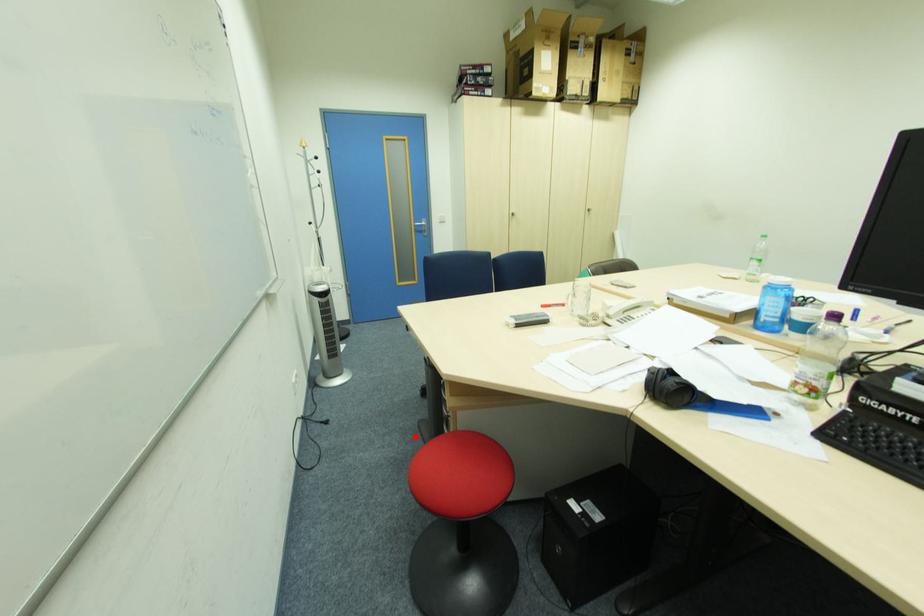
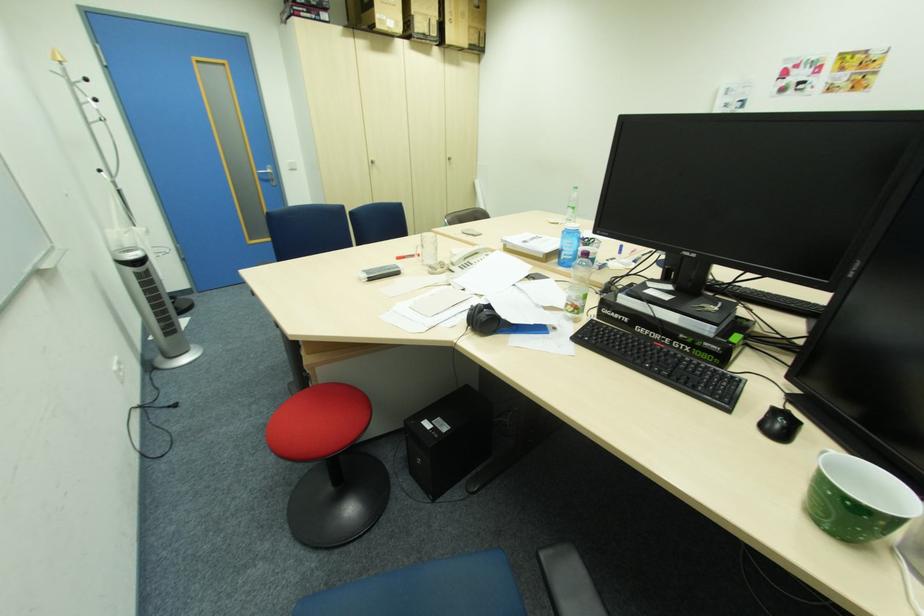
Question: A red point is marked in image1. In image2, is the corresponding 3D point closer to the camera or farther? Reply with the corresponding letter.

Choices:
 (A) The corresponding 3D point is closer.
 (B) The corresponding 3D point is farther.

Answer: (B)